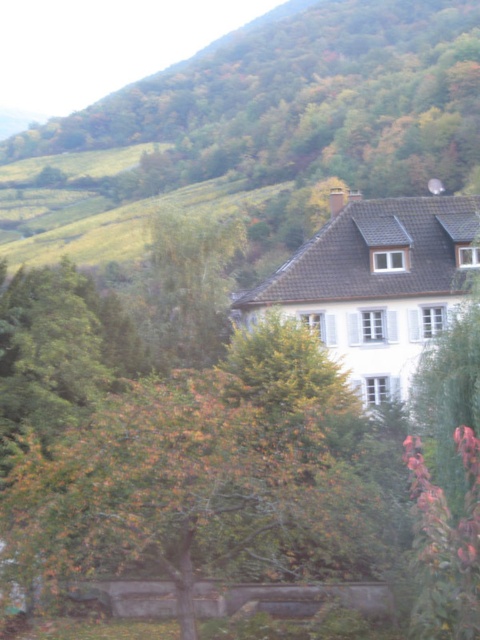
Can you confirm if green leafy hillside at upper center is taller than autumn leaves tree at center?

Correct, green leafy hillside at upper center is much taller as autumn leaves tree at center.

Where is `green leafy hillside at upper center`? green leafy hillside at upper center is located at coordinates (299, 104).